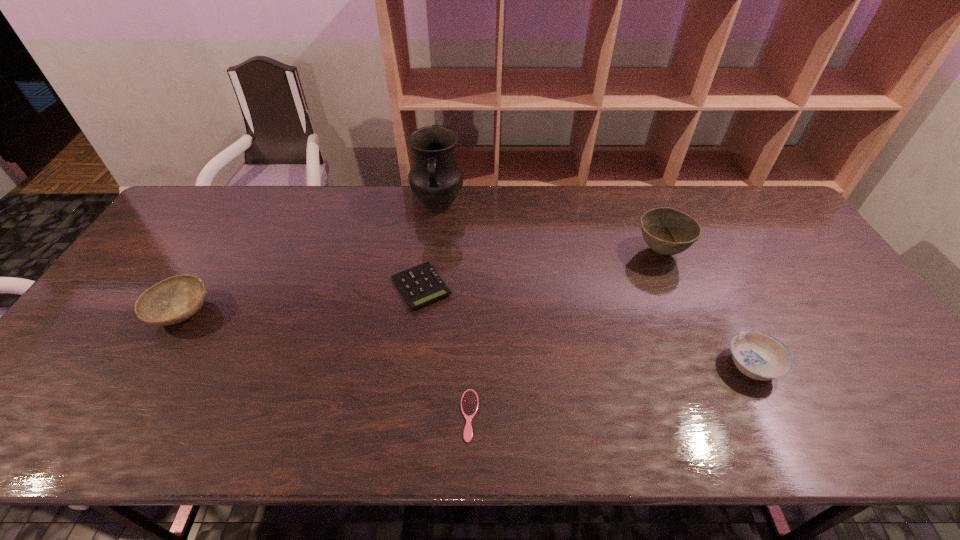
At what (x,y) coordinates should I click in order to perform the action: click on bowl identified as the second closest to the second shortest object. Please return your answer as a coordinate pair (x, y). This screenshot has height=540, width=960. Looking at the image, I should click on (667, 231).

Find the location of `free space that satisfies the following two spatial constraints: 1. on the handle side of the farthest object; 2. on the left side of the fourth object from left to right`. free space that satisfies the following two spatial constraints: 1. on the handle side of the farthest object; 2. on the left side of the fourth object from left to right is located at coordinates (416, 415).

Locate an element on the screen. free space that satisfies the following two spatial constraints: 1. on the handle side of the fourth tallest object; 2. on the left side of the farthest object is located at coordinates (420, 366).

Find the location of a particular element. This screenshot has width=960, height=540. vacant region that satisfies the following two spatial constraints: 1. on the front side of the tallest bowl; 2. on the right side of the shortest bowl is located at coordinates (708, 366).

This screenshot has height=540, width=960. In order to click on free spot that satisfies the following two spatial constraints: 1. on the handle side of the farthest bowl; 2. on the right side of the tallest object in this screenshot , I will do `click(433, 252)`.